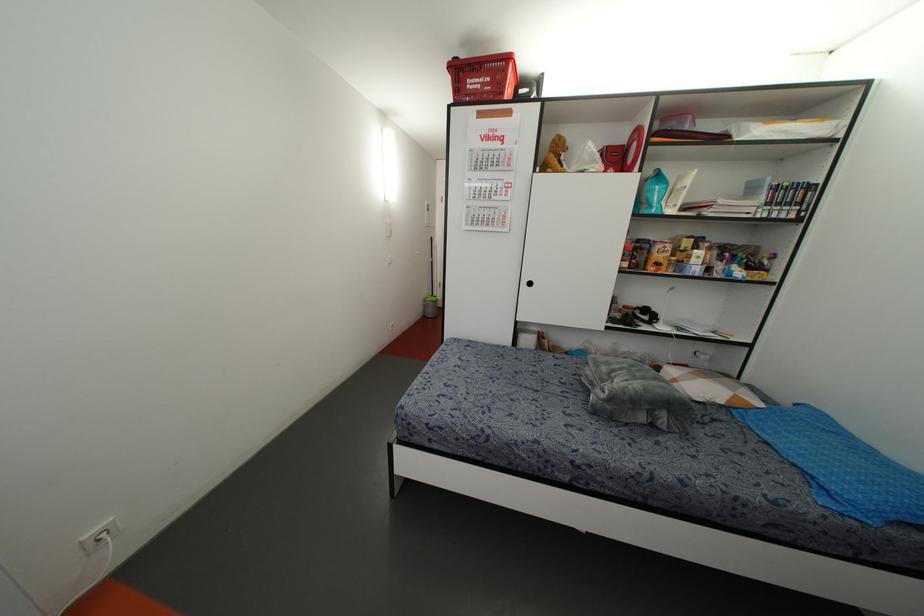
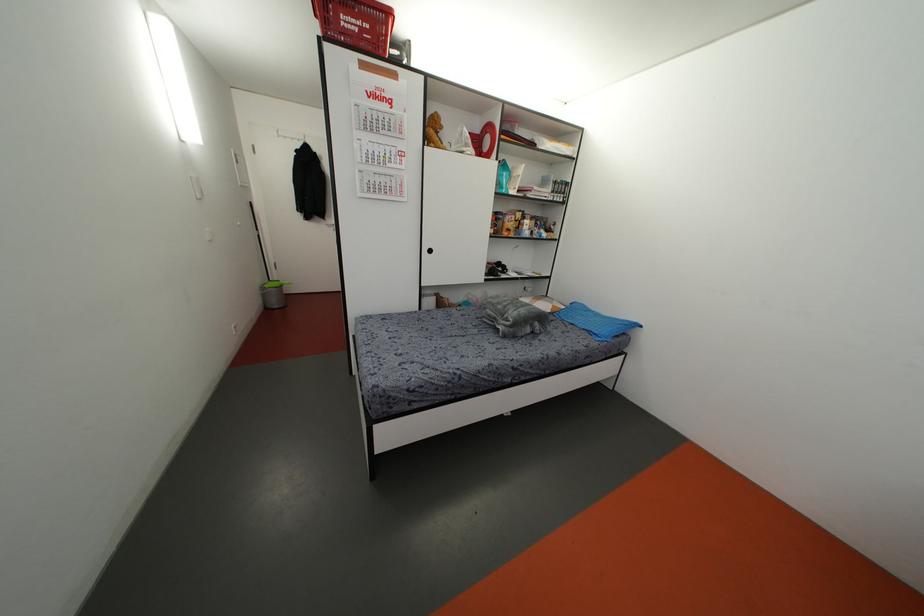
Where in the second image is the point corresponding to point 652,209 from the first image?

(503, 191)